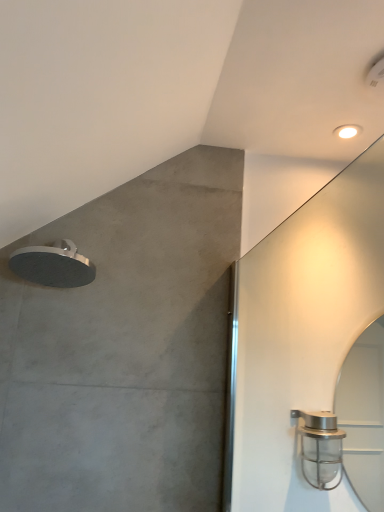
This screenshot has width=384, height=512. I want to click on satin silver showerhead at upper left, the 1th shower from the top, so click(53, 265).

Does point (348, 134) appear closer or farther from the camera than point (70, 243)?

Point (348, 134) appears to be farther away from the viewer than point (70, 243).

Is white glossy droplight at upper right positioned with its back to satin silver showerhead at upper left, which is the 2th shower in bottom-to-top order?

No, white glossy droplight at upper right is not facing the opposite direction of satin silver showerhead at upper left, which is the 2th shower in bottom-to-top order.

From the image's perspective, is white glossy droplight at upper right located above satin silver showerhead at upper left, placed as the 1th shower when sorted from left to right?

Correct, white glossy droplight at upper right appears higher than satin silver showerhead at upper left, placed as the 1th shower when sorted from left to right, in the image.

Can you tell me how much white glossy droplight at upper right and satin silver showerhead at upper left, which is the second shower from right to left, differ in facing direction?

There is a 89.3-degree angle between the facing directions of white glossy droplight at upper right and satin silver showerhead at upper left, which is the second shower from right to left.

From a real-world perspective, which object stands above the other?

From a 3D spatial view, white glossy droplight at upper right is above.

Is white glossy droplight at upper right completely or partially inside satin nickel shower head at right, which is the 1th shower in right-to-left order?

No, white glossy droplight at upper right is located outside of satin nickel shower head at right, which is the 1th shower in right-to-left order.

Which object is further away from the camera taking this photo, satin nickel shower head at right, which is the second shower from top to bottom, or white glossy droplight at upper right?

white glossy droplight at upper right is more distant.

This screenshot has width=384, height=512. I want to click on shower that is below the satin silver showerhead at upper left, placed as the 1th shower when sorted from left to right (from the image's perspective), so click(320, 448).

Can you confirm if satin silver showerhead at upper left, placed as the 1th shower when sorted from left to right, is wider than satin nickel shower head at right, which is the 1th shower in right-to-left order?

No.

Is satin silver showerhead at upper left, which is the 2th shower in bottom-to-top order, inside or outside of satin nickel shower head at right, the second shower when ordered from left to right?

satin silver showerhead at upper left, which is the 2th shower in bottom-to-top order, cannot be found inside satin nickel shower head at right, the second shower when ordered from left to right.

From the image's perspective, who appears lower, satin silver showerhead at upper left, the 1th shower from the top, or satin nickel shower head at right, which is the second shower from top to bottom?

satin nickel shower head at right, which is the second shower from top to bottom, is shown below in the image.

Which object is wider, satin nickel shower head at right, the second shower when ordered from left to right, or satin silver showerhead at upper left, placed as the 1th shower when sorted from left to right?

Wider between the two is satin nickel shower head at right, the second shower when ordered from left to right.

Does satin nickel shower head at right, the second shower when ordered from left to right, contain satin silver showerhead at upper left, placed as the 1th shower when sorted from left to right?

That's incorrect, satin silver showerhead at upper left, placed as the 1th shower when sorted from left to right, is not inside satin nickel shower head at right, the second shower when ordered from left to right.

Consider the image. In the image, is satin nickel shower head at right, the 1th shower positioned from the bottom, positioned in front of or behind satin silver showerhead at upper left, placed as the 1th shower when sorted from left to right?

Clearly, satin nickel shower head at right, the 1th shower positioned from the bottom, is in front of satin silver showerhead at upper left, placed as the 1th shower when sorted from left to right.

Where is `shower to the right of satin silver showerhead at upper left, which is the 2th shower in bottom-to-top order`? Image resolution: width=384 pixels, height=512 pixels. shower to the right of satin silver showerhead at upper left, which is the 2th shower in bottom-to-top order is located at coordinates (320, 448).

Does satin silver showerhead at upper left, which is the second shower from right to left, have a lesser height compared to white glossy droplight at upper right?

No, satin silver showerhead at upper left, which is the second shower from right to left, is not shorter than white glossy droplight at upper right.

In the scene shown: Relative to white glossy droplight at upper right, is satin silver showerhead at upper left, which is the 2th shower in bottom-to-top order, in front or behind?

Clearly, satin silver showerhead at upper left, which is the 2th shower in bottom-to-top order, is in front of white glossy droplight at upper right.

Is satin silver showerhead at upper left, the 1th shower from the top, not within white glossy droplight at upper right?

Indeed, satin silver showerhead at upper left, the 1th shower from the top, is completely outside white glossy droplight at upper right.

Which shower is the 1st one when counting from the front of the white glossy droplight at upper right? Please provide its 2D coordinates.

[(53, 265)]

Where is `droplight that appears on the right of satin nickel shower head at right, which is the second shower from top to bottom`? This screenshot has width=384, height=512. droplight that appears on the right of satin nickel shower head at right, which is the second shower from top to bottom is located at coordinates (347, 131).

From the image's perspective, which is above, white glossy droplight at upper right or satin nickel shower head at right, the 1th shower positioned from the bottom?

From the image's view, white glossy droplight at upper right is above.

Which point is more forward, (336, 130) or (318, 424)?

The point (318, 424) is closer.

From the picture: Is there a large distance between white glossy droplight at upper right and satin nickel shower head at right, the second shower when ordered from left to right?

No, there isn't a large distance between white glossy droplight at upper right and satin nickel shower head at right, the second shower when ordered from left to right.

The image size is (384, 512). There is a white glossy droplight at upper right. In order to click on the 1st shower below it (from a real-world perspective) in this screenshot , I will do `click(53, 265)`.

Image resolution: width=384 pixels, height=512 pixels. There is a white glossy droplight at upper right. Find the location of `the 2nd shower below it (from the image's perspective)`. the 2nd shower below it (from the image's perspective) is located at coordinates (320, 448).

Based on their spatial positions, is satin nickel shower head at right, which is the 1th shower in right-to-left order, or white glossy droplight at upper right further from satin silver showerhead at upper left, which is the second shower from right to left?

white glossy droplight at upper right lies further to satin silver showerhead at upper left, which is the second shower from right to left, than the other object.

From the image, which object appears to be farther from white glossy droplight at upper right, satin nickel shower head at right, which is the second shower from top to bottom, or satin silver showerhead at upper left, which is the second shower from right to left?

satin silver showerhead at upper left, which is the second shower from right to left, is further to white glossy droplight at upper right.

Based on their spatial positions, is satin silver showerhead at upper left, the 1th shower from the top, or white glossy droplight at upper right further from satin nickel shower head at right, which is the second shower from top to bottom?

Based on the image, white glossy droplight at upper right appears to be further to satin nickel shower head at right, which is the second shower from top to bottom.

Estimate the real-world distances between objects in this image. Which object is closer to satin nickel shower head at right, which is the 1th shower in right-to-left order, white glossy droplight at upper right or satin silver showerhead at upper left, which is the 2th shower in bottom-to-top order?

→ satin silver showerhead at upper left, which is the 2th shower in bottom-to-top order.

When comparing their distances from white glossy droplight at upper right, does satin silver showerhead at upper left, the 1th shower from the top, or satin nickel shower head at right, the 1th shower positioned from the bottom, seem closer?

Based on the image, satin nickel shower head at right, the 1th shower positioned from the bottom, appears to be nearer to white glossy droplight at upper right.

Which object lies nearer to the anchor point satin silver showerhead at upper left, placed as the 1th shower when sorted from left to right, white glossy droplight at upper right or satin nickel shower head at right, which is the second shower from top to bottom?

The object closer to satin silver showerhead at upper left, placed as the 1th shower when sorted from left to right, is satin nickel shower head at right, which is the second shower from top to bottom.

Identify the location of shower situated between satin silver showerhead at upper left, placed as the 1th shower when sorted from left to right, and white glossy droplight at upper right from left to right. (320, 448).